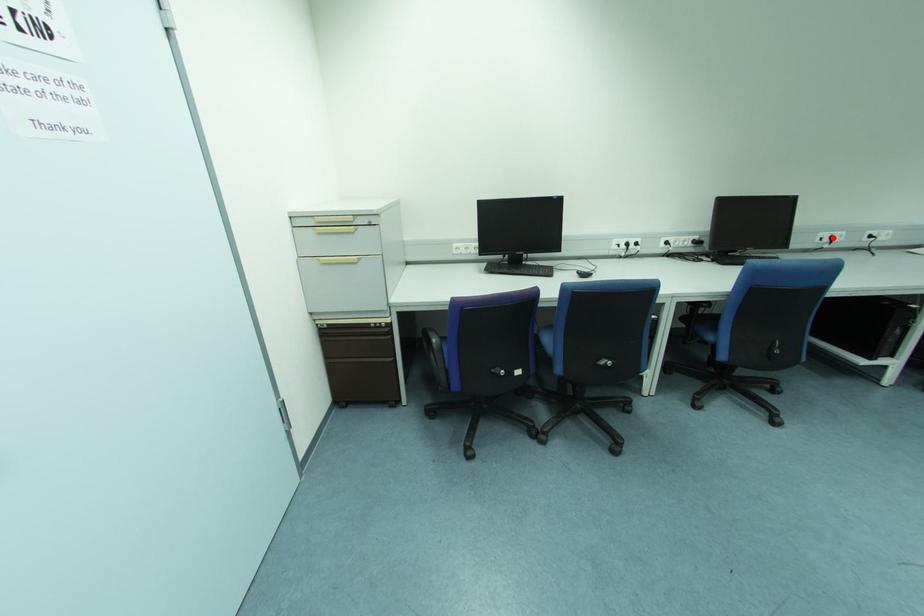
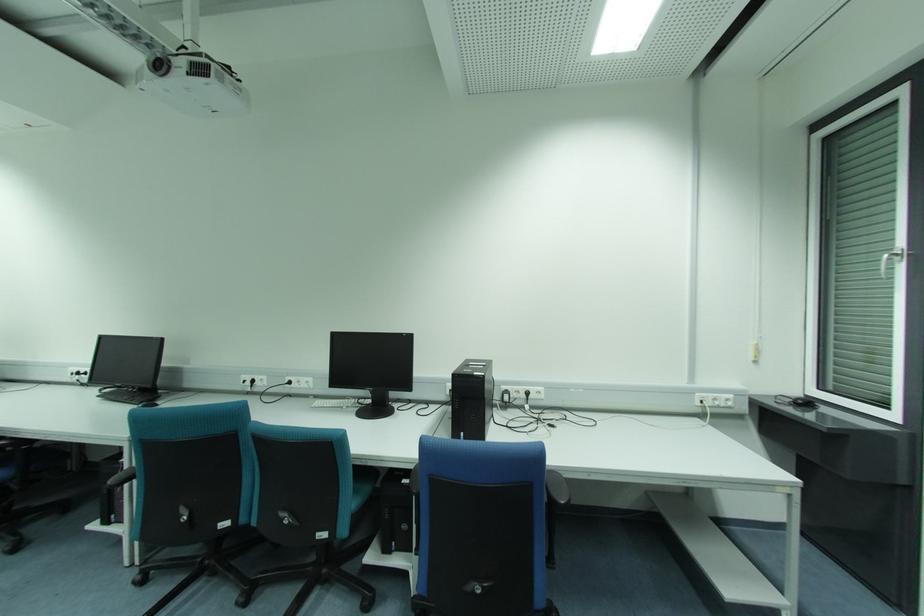
Question: I am providing you with two images of the same scene from different viewpoints. A red point is marked on the first image. At the location where the point appears in image 1, is it still visible in image 2?

Choices:
 (A) Yes
 (B) No

Answer: (A)